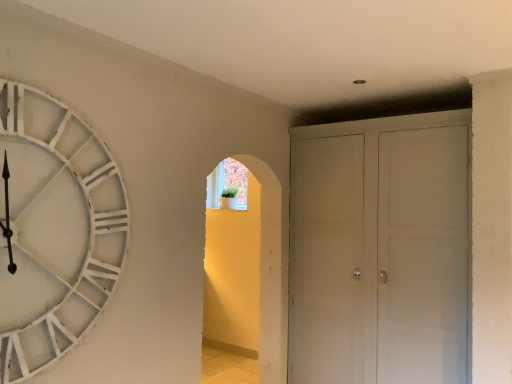
Locate an element on the screen. The height and width of the screenshot is (384, 512). white wooden clock at left is located at coordinates (55, 230).

The height and width of the screenshot is (384, 512). What do you see at coordinates (55, 230) in the screenshot? I see `white wooden clock at left` at bounding box center [55, 230].

The image size is (512, 384). What do you see at coordinates (380, 250) in the screenshot?
I see `white matte cabinet at right` at bounding box center [380, 250].

Locate an element on the screen. Image resolution: width=512 pixels, height=384 pixels. white matte cabinet at right is located at coordinates (380, 250).

The image size is (512, 384). In order to click on white wooden clock at left in this screenshot , I will do `click(55, 230)`.

Which is more to the left, white matte cabinet at right or white wooden clock at left?

Positioned to the left is white wooden clock at left.

Considering their positions, is white matte cabinet at right located in front of or behind white wooden clock at left?

In the image, white matte cabinet at right appears behind white wooden clock at left.

Is point (354, 179) positioned before point (53, 295)?

No, it is behind (53, 295).

From the image's perspective, is white matte cabinet at right above or below white wooden clock at left?

Based on their image positions, white matte cabinet at right is located beneath white wooden clock at left.

From a real-world perspective, relative to white wooden clock at left, is white matte cabinet at right vertically above or below?

In terms of real-world spatial position, white matte cabinet at right is below white wooden clock at left.

Which of these two, white matte cabinet at right or white wooden clock at left, is thinner?

white wooden clock at left is thinner.

Is white matte cabinet at right taller or shorter than white wooden clock at left?

Clearly, white matte cabinet at right is taller compared to white wooden clock at left.

In terms of size, does white matte cabinet at right appear bigger or smaller than white wooden clock at left?

In the image, white matte cabinet at right appears to be larger than white wooden clock at left.

From the picture: Is white matte cabinet at right surrounding white wooden clock at left?

Result: No, white wooden clock at left is located outside of white matte cabinet at right.

Is white matte cabinet at right far from white wooden clock at left?

Absolutely, white matte cabinet at right is distant from white wooden clock at left.

Is white matte cabinet at right oriented away from white wooden clock at left?

No, white matte cabinet at right is not facing the opposite direction of white wooden clock at left.

Can you tell me how much white matte cabinet at right and white wooden clock at left differ in facing direction?

The angle between the facing direction of white matte cabinet at right and the facing direction of white wooden clock at left is 90.7 degrees.

This screenshot has height=384, width=512. I want to click on wall clock above the white matte cabinet at right (from a real-world perspective), so click(55, 230).

In the image, is white wooden clock at left on the left side or the right side of white matte cabinet at right?

In the image, white wooden clock at left appears on the left side of white matte cabinet at right.

Looking at this image, considering their positions, is white wooden clock at left located in front of or behind white matte cabinet at right?

white wooden clock at left is positioned closer to the viewer than white matte cabinet at right.

Does point (18, 268) lie in front of point (307, 174)?

Yes.

From the image's perspective, is white wooden clock at left over white matte cabinet at right?

Correct, white wooden clock at left appears higher than white matte cabinet at right in the image.

From a real-world perspective, is white wooden clock at left on white matte cabinet at right?

Yes.

Can you confirm if white wooden clock at left is thinner than white matte cabinet at right?

Correct, the width of white wooden clock at left is less than that of white matte cabinet at right.

Considering the relative sizes of white wooden clock at left and white matte cabinet at right in the image provided, is white wooden clock at left shorter than white matte cabinet at right?

Correct, white wooden clock at left is not as tall as white matte cabinet at right.

Considering the sizes of objects white wooden clock at left and white matte cabinet at right in the image provided, who is bigger, white wooden clock at left or white matte cabinet at right?

white matte cabinet at right is bigger.

Can white matte cabinet at right be found inside white wooden clock at left?

That's incorrect, white matte cabinet at right is not inside white wooden clock at left.

Is white wooden clock at left directly adjacent to white matte cabinet at right?

white wooden clock at left is not next to white matte cabinet at right, and they're not touching.

Could you tell me if white wooden clock at left is facing white matte cabinet at right?

No, white wooden clock at left is not turned towards white matte cabinet at right.

In the scene shown: What's the angular difference between white wooden clock at left and white matte cabinet at right's facing directions?

The angular difference between white wooden clock at left and white matte cabinet at right is 90.7 degrees.

Identify the location of door on the right of white wooden clock at left. (380, 250).

You are a GUI agent. You are given a task and a screenshot of the screen. Output one action in this format:
    pyautogui.click(x=<x>, y=<y>)
    Task: Click on the door that is behind the white wooden clock at left
    This screenshot has width=512, height=384.
    Given the screenshot: What is the action you would take?
    380,250

The image size is (512, 384). What are the coordinates of `wall clock located above the white matte cabinet at right (from the image's perspective)` in the screenshot? It's located at (55, 230).